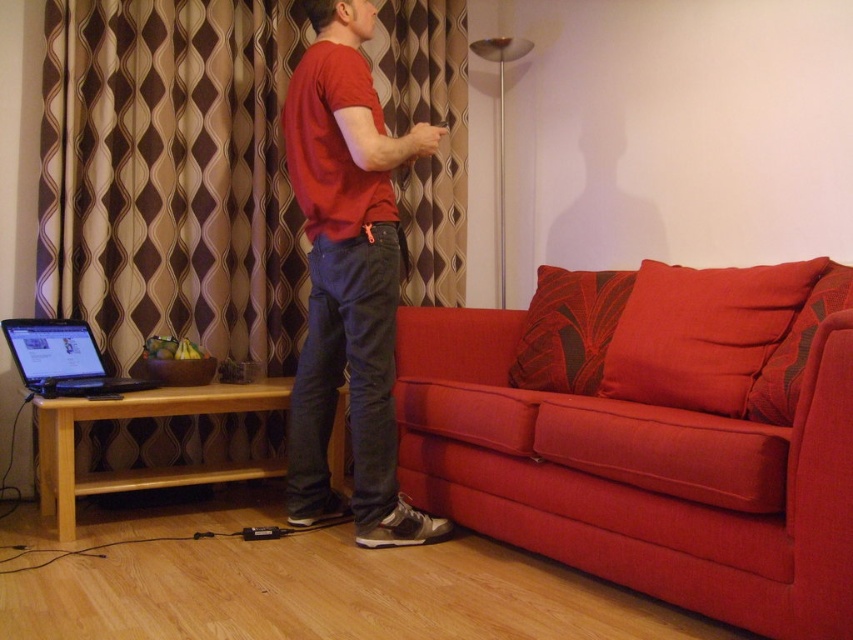
Is red fabric couch at lower right smaller than matte red t-shirt at center?

Actually, red fabric couch at lower right might be larger than matte red t-shirt at center.

Who is more forward, (701, 410) or (315, 458)?

Positioned in front is point (701, 410).

Which is in front, point (550, 540) or point (318, 376)?

Positioned in front is point (550, 540).

Identify the location of red fabric couch at lower right. Image resolution: width=853 pixels, height=640 pixels. (651, 435).

Does brown textured curtain at upper left have a smaller size compared to matte black laptop at left?

Incorrect, brown textured curtain at upper left is not smaller in size than matte black laptop at left.

Where is `brown textured curtain at upper left`? This screenshot has width=853, height=640. brown textured curtain at upper left is located at coordinates (171, 177).

Does red fabric couch at lower right have a greater height compared to brown textured curtain at upper left?

In fact, red fabric couch at lower right may be shorter than brown textured curtain at upper left.

Which of these two, red fabric couch at lower right or brown textured curtain at upper left, stands shorter?

Standing shorter between the two is red fabric couch at lower right.

Describe the element at coordinates (651, 435) in the screenshot. I see `red fabric couch at lower right` at that location.

Where is `red fabric couch at lower right`? red fabric couch at lower right is located at coordinates (651, 435).